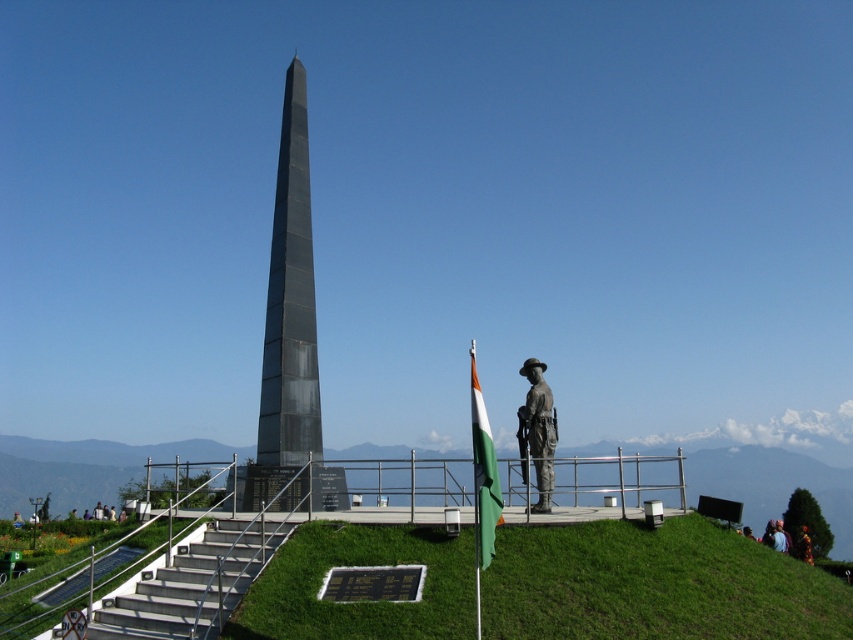
Question: Can you confirm if green grassy at center is positioned to the right of black polished stone obelisk at center?

Choices:
 (A) yes
 (B) no

Answer: (A)

Question: Considering the real-world distances, which object is farthest from the green grassy at center?

Choices:
 (A) tri-colored fabric flag at center
 (B) metal/stainless steel stairs at lower left
 (C) black polished stone obelisk at center

Answer: (C)

Question: Among these points, which one is farthest from the camera?

Choices:
 (A) (315, 573)
 (B) (236, 570)
 (C) (483, 566)
 (D) (543, 440)

Answer: (D)

Question: Is green grassy at center bigger than metal/stainless steel stairs at lower left?

Choices:
 (A) no
 (B) yes

Answer: (B)

Question: Is black polished stone obelisk at center closer to camera compared to bronze statue at center?

Choices:
 (A) no
 (B) yes

Answer: (B)

Question: Estimate the real-world distances between objects in this image. Which object is farther from the metal/stainless steel stairs at lower left?

Choices:
 (A) bronze statue at center
 (B) black polished stone obelisk at center
 (C) green grassy at center
 (D) tri-colored fabric flag at center

Answer: (A)